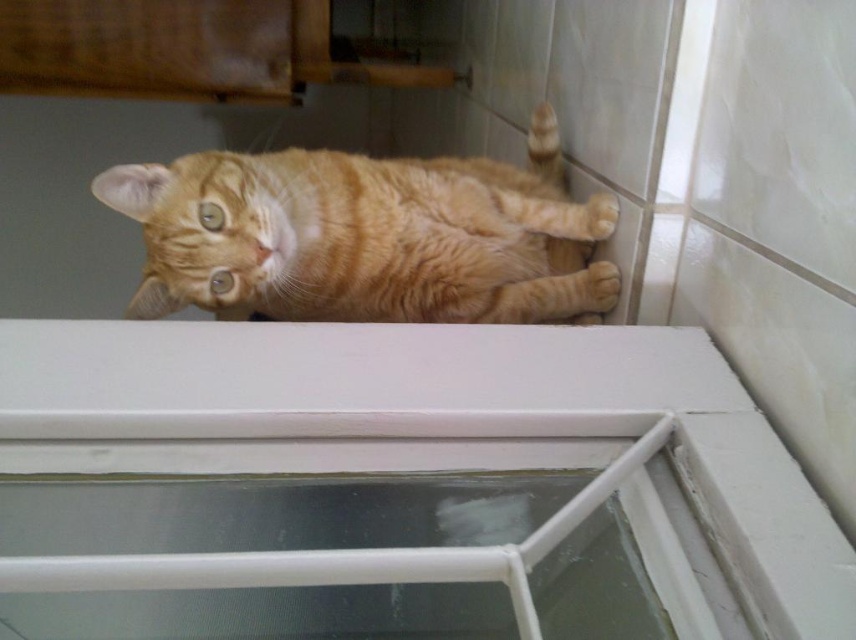
From the picture: Can you confirm if orange tabby cat at upper center is positioned above transparent plastic window at center?

Indeed, orange tabby cat at upper center is positioned over transparent plastic window at center.

Does point (474, 211) come farther from viewer compared to point (563, 513)?

Yes, it is behind point (563, 513).

In order to click on orange tabby cat at upper center in this screenshot , I will do click(367, 236).